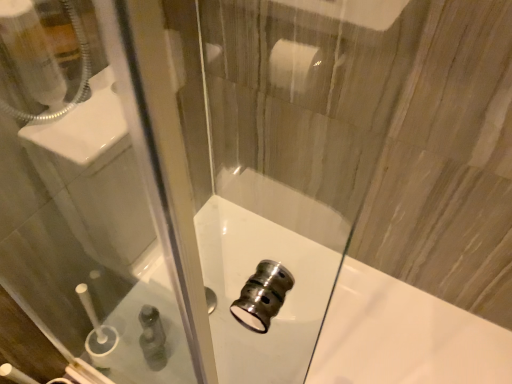
You are a GUI agent. You are given a task and a screenshot of the screen. Output one action in this format:
    pyautogui.click(x=<x>, y=<y>)
    Task: Click on the free space to the back side of green plastic bottle at lower left
    This screenshot has height=384, width=512.
    Given the screenshot: What is the action you would take?
    pyautogui.click(x=158, y=331)